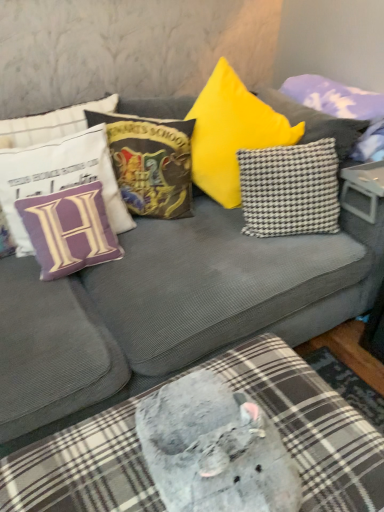
Question: Would you consider velvet hogwarts school of witchcraft and wizardry pillow at upper center, which ranks as the third pillow in left-to-right order, to be distant from checkered fabric pillow at upper right, which appears as the 5th pillow when viewed from the left?

Choices:
 (A) no
 (B) yes

Answer: (A)

Question: Can you confirm if velvet hogwarts school of witchcraft and wizardry pillow at upper center, which is counted as the third pillow, starting from the right, is taller than checkered fabric pillow at upper right, which appears as the 5th pillow when viewed from the left?

Choices:
 (A) yes
 (B) no

Answer: (A)

Question: Can you confirm if velvet hogwarts school of witchcraft and wizardry pillow at upper center, which ranks as the third pillow in left-to-right order, is smaller than checkered fabric pillow at upper right, acting as the 1th pillow starting from the right?

Choices:
 (A) no
 (B) yes

Answer: (B)

Question: Considering the relative sizes of velvet hogwarts school of witchcraft and wizardry pillow at upper center, which ranks as the third pillow in left-to-right order, and checkered fabric pillow at upper right, acting as the 1th pillow starting from the right, in the image provided, is velvet hogwarts school of witchcraft and wizardry pillow at upper center, which ranks as the third pillow in left-to-right order, thinner than checkered fabric pillow at upper right, acting as the 1th pillow starting from the right,?

Choices:
 (A) no
 (B) yes

Answer: (B)

Question: Considering the relative positions of velvet hogwarts school of witchcraft and wizardry pillow at upper center, which ranks as the third pillow in left-to-right order, and checkered fabric pillow at upper right, which appears as the 5th pillow when viewed from the left, in the image provided, is velvet hogwarts school of witchcraft and wizardry pillow at upper center, which ranks as the third pillow in left-to-right order, behind checkered fabric pillow at upper right, which appears as the 5th pillow when viewed from the left,?

Choices:
 (A) yes
 (B) no

Answer: (B)

Question: In the image, is plush gray cushion at lower center on the left side or the right side of plastic gray table at center?

Choices:
 (A) left
 (B) right

Answer: (A)

Question: From the image's perspective, is plush gray cushion at lower center positioned above or below plastic gray table at center?

Choices:
 (A) above
 (B) below

Answer: (B)

Question: From a real-world perspective, is plush gray cushion at lower center positioned above or below plastic gray table at center?

Choices:
 (A) above
 (B) below

Answer: (B)

Question: Based on their sizes in the image, would you say plush gray cushion at lower center is bigger or smaller than plastic gray table at center?

Choices:
 (A) small
 (B) big

Answer: (B)

Question: Considering the positions of plush gray cushion at lower center and black-and-white checkered pillow at center-right, positioned as the 4th pillow in left-to-right order, in the image, is plush gray cushion at lower center taller or shorter than black-and-white checkered pillow at center-right, positioned as the 4th pillow in left-to-right order,?

Choices:
 (A) tall
 (B) short

Answer: (B)

Question: Would you say plush gray cushion at lower center is to the left or to the right of black-and-white checkered pillow at center-right, positioned as the 4th pillow in left-to-right order, in the picture?

Choices:
 (A) right
 (B) left

Answer: (B)

Question: Considering the positions of point (284, 413) and point (259, 163), is point (284, 413) closer or farther from the camera than point (259, 163)?

Choices:
 (A) closer
 (B) farther

Answer: (A)

Question: From a real-world perspective, is plush gray cushion at lower center physically located above or below black-and-white checkered pillow at center-right, positioned as the 2th pillow in right-to-left order?

Choices:
 (A) above
 (B) below

Answer: (B)

Question: Is plush gray cushion at lower center bigger or smaller than purple fabric pillow at left, which ranks as the second pillow in left-to-right order?

Choices:
 (A) big
 (B) small

Answer: (A)

Question: Is plush gray cushion at lower center inside or outside of purple fabric pillow at left, which ranks as the second pillow in left-to-right order?

Choices:
 (A) inside
 (B) outside

Answer: (B)